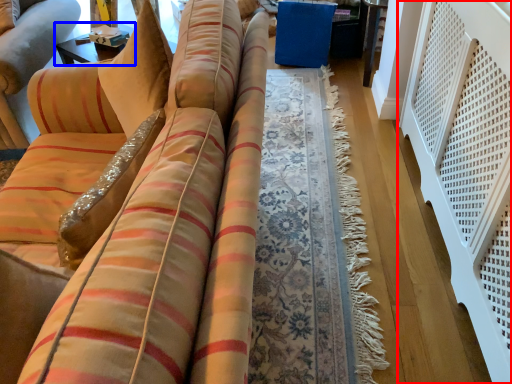
Question: Among these objects, which one is farthest to the camera, balustrade (highlighted by a red box) or table (highlighted by a blue box)?

Choices:
 (A) balustrade
 (B) table

Answer: (B)